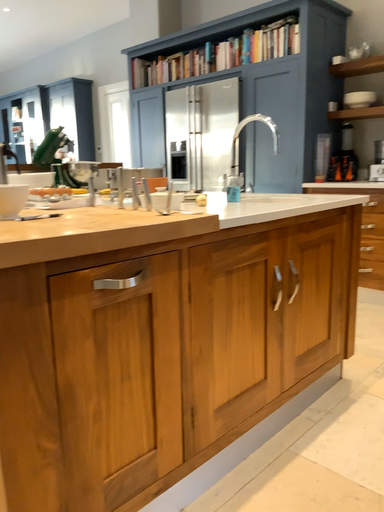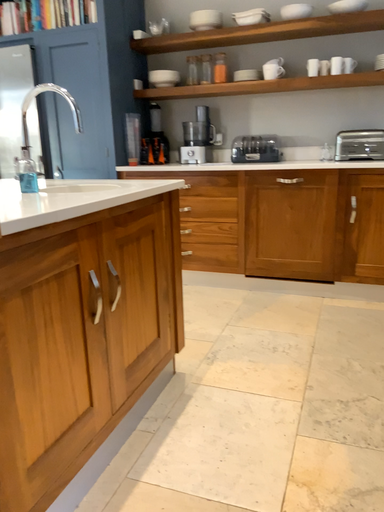
Question: How did the camera likely rotate when shooting the video?

Choices:
 (A) rotated left
 (B) rotated right

Answer: (B)